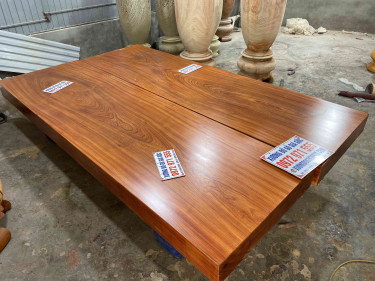
Locate an element on the screen. This screenshot has height=281, width=375. wall banner is located at coordinates (49, 13).